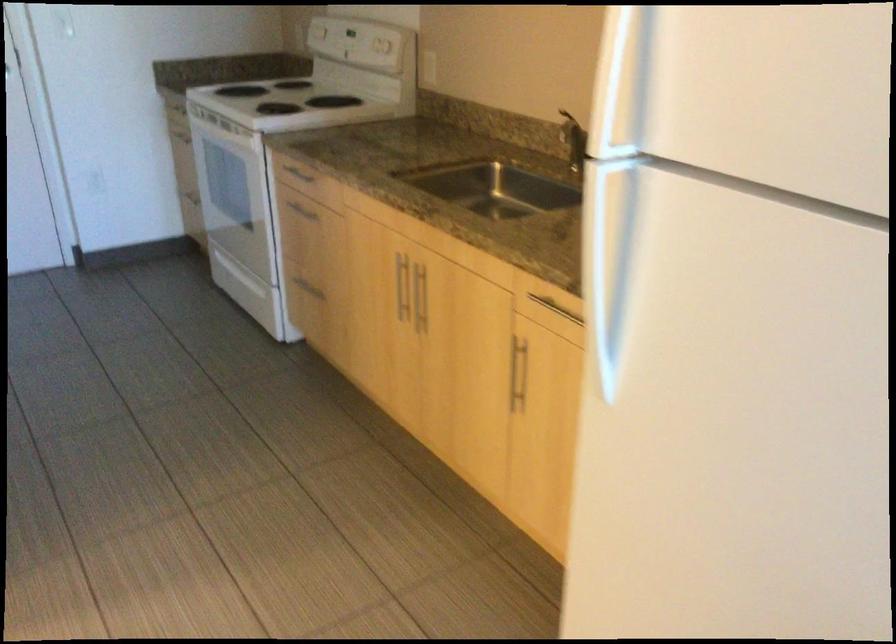
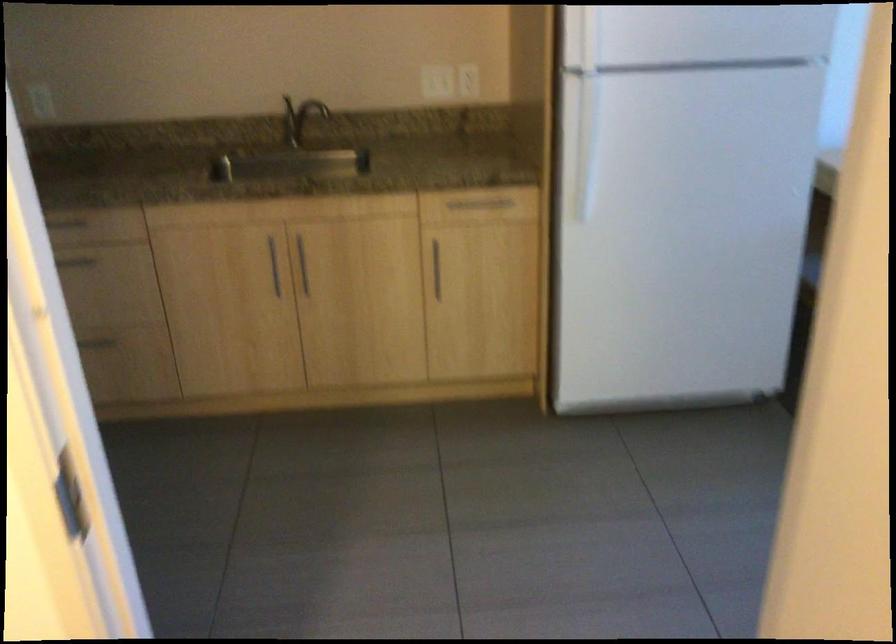
Where in the second image is the point corresponding to [401,283] from the first image?

(273, 265)